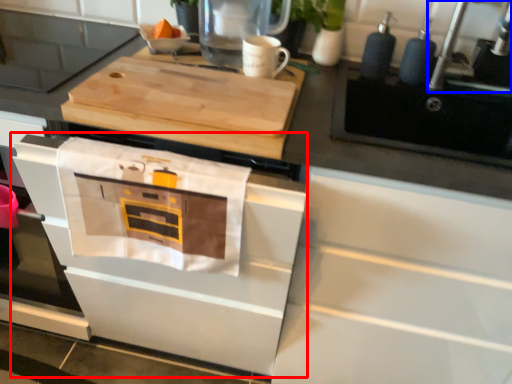
Question: Among these objects, which one is nearest to the camera, oven (highlighted by a red box) or faucet (highlighted by a blue box)?

Choices:
 (A) oven
 (B) faucet

Answer: (A)